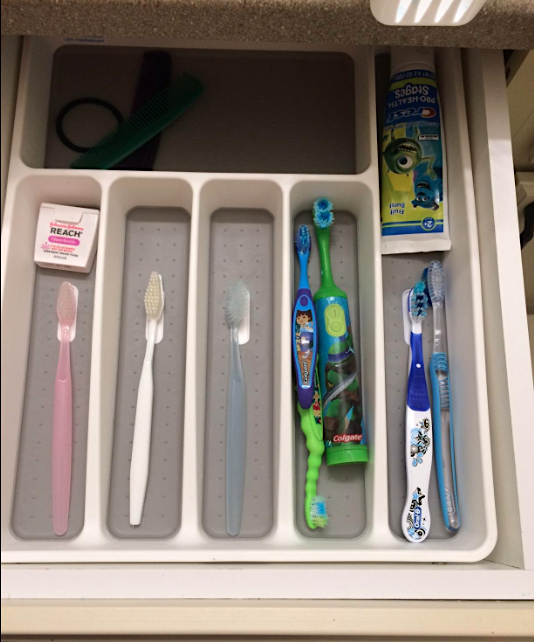
This screenshot has height=642, width=534. Identify the location of brush head. (235, 300), (153, 293), (65, 299), (328, 209), (306, 238), (321, 508), (420, 300), (428, 273).